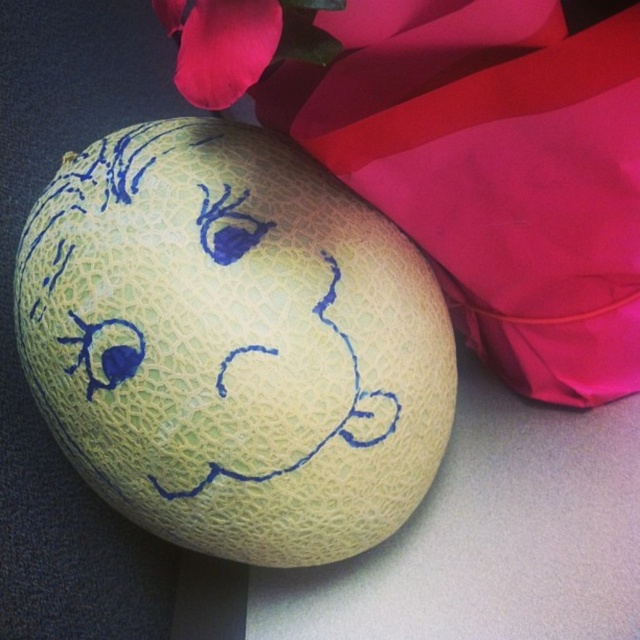
Question: Which object is farther from the camera taking this photo?

Choices:
 (A) matte pink petal at upper left
 (B) green textured cantaloupe at center

Answer: (B)

Question: Observing the image, what is the correct spatial positioning of green textured cantaloupe at center in reference to matte pink petal at upper left?

Choices:
 (A) above
 (B) below

Answer: (B)

Question: Which point is farther from the camera taking this photo?

Choices:
 (A) (168, 483)
 (B) (182, 36)

Answer: (A)

Question: Which point is closer to the camera?

Choices:
 (A) green textured cantaloupe at center
 (B) matte pink petal at upper left

Answer: (B)

Question: Can you confirm if green textured cantaloupe at center is wider than matte pink petal at upper left?

Choices:
 (A) no
 (B) yes

Answer: (B)

Question: Is green textured cantaloupe at center further to the viewer compared to matte pink petal at upper left?

Choices:
 (A) yes
 (B) no

Answer: (A)